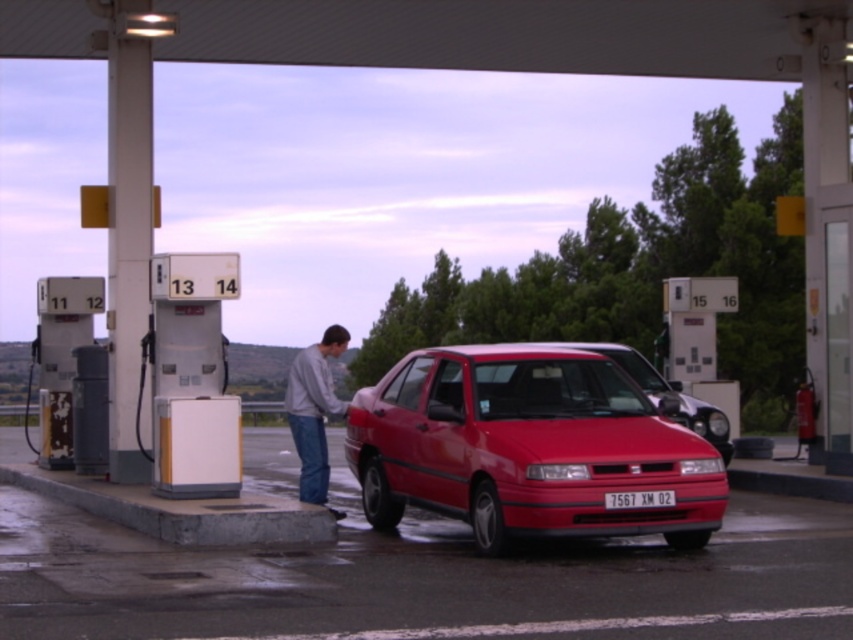
Does matte red sedan at center have a greater width compared to white plastic license plate at center?

Yes, matte red sedan at center is wider than white plastic license plate at center.

Who is more forward, (587, 344) or (634, 502)?

Positioned in front is point (634, 502).

Find the location of `matte red sedan at center`. matte red sedan at center is located at coordinates (660, 392).

Does shiny red sedan at center appear on the left side of white plastic license plate at center?

Correct, you'll find shiny red sedan at center to the left of white plastic license plate at center.

Is shiny red sedan at center to the right of white plastic license plate at center from the viewer's perspective?

Incorrect, shiny red sedan at center is not on the right side of white plastic license plate at center.

What do you see at coordinates (527, 445) in the screenshot?
I see `shiny red sedan at center` at bounding box center [527, 445].

Locate an element on the screen. shiny red sedan at center is located at coordinates (527, 445).

Who is lower down, gray cotton shirt at center or matte red sedan at center?

gray cotton shirt at center

Is gray cotton shirt at center wider than matte red sedan at center?

No, gray cotton shirt at center is not wider than matte red sedan at center.

Where is `gray cotton shirt at center`? The image size is (853, 640). gray cotton shirt at center is located at coordinates (314, 412).